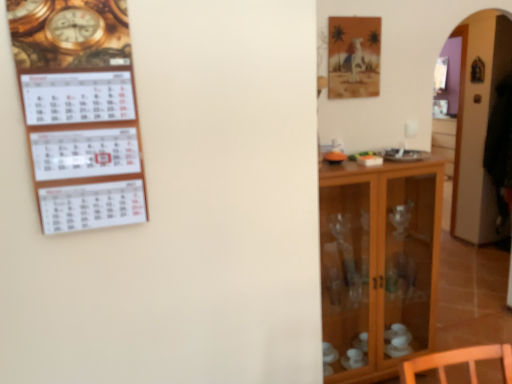
Question: Is white paper calendar at left turned away from transparent glass cabinet at right?

Choices:
 (A) no
 (B) yes

Answer: (A)

Question: Can you confirm if white paper calendar at left is shorter than transparent glass cabinet at right?

Choices:
 (A) no
 (B) yes

Answer: (B)

Question: Does white paper calendar at left have a smaller size compared to transparent glass cabinet at right?

Choices:
 (A) yes
 (B) no

Answer: (A)

Question: Can you confirm if white paper calendar at left is taller than transparent glass cabinet at right?

Choices:
 (A) no
 (B) yes

Answer: (A)

Question: Is white paper calendar at left at the right side of transparent glass cabinet at right?

Choices:
 (A) no
 (B) yes

Answer: (A)

Question: Is white paper calendar at left located outside transparent glass cabinet at right?

Choices:
 (A) no
 (B) yes

Answer: (B)

Question: Is there a large distance between wooden cabinet at right and transparent glass cabinet at right?

Choices:
 (A) yes
 (B) no

Answer: (A)

Question: Is the position of wooden cabinet at right less distant than that of transparent glass cabinet at right?

Choices:
 (A) no
 (B) yes

Answer: (B)

Question: From a real-world perspective, is wooden cabinet at right positioned under transparent glass cabinet at right based on gravity?

Choices:
 (A) no
 (B) yes

Answer: (B)

Question: Is wooden cabinet at right bigger than transparent glass cabinet at right?

Choices:
 (A) yes
 (B) no

Answer: (B)

Question: Is wooden cabinet at right facing towards transparent glass cabinet at right?

Choices:
 (A) no
 (B) yes

Answer: (A)

Question: Could transparent glass cabinet at right be considered to be inside wooden cabinet at right?

Choices:
 (A) no
 (B) yes

Answer: (A)

Question: Considering the relative positions of transparent glass cabinet at right and white paper calendar at left in the image provided, is transparent glass cabinet at right to the left of white paper calendar at left from the viewer's perspective?

Choices:
 (A) no
 (B) yes

Answer: (A)